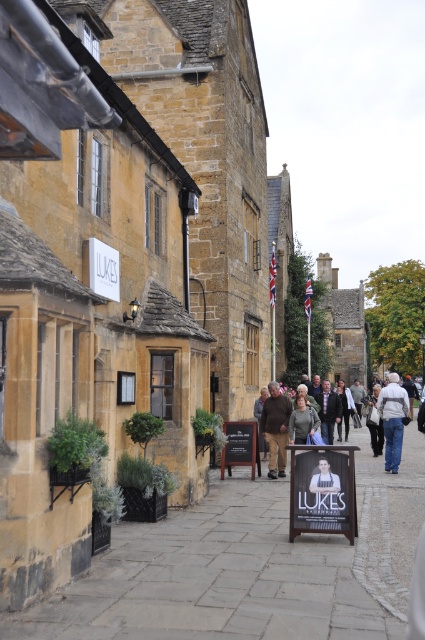
Question: Does brown leather jacket at center appear on the right side of light gray fabric jacket at center?

Choices:
 (A) no
 (B) yes

Answer: (A)

Question: Which point is farther to the camera?

Choices:
 (A) paved stone at center
 (B) light gray fabric jacket at center

Answer: (B)

Question: Does brown leather jacket at center have a smaller size compared to light gray fabric jacket at center?

Choices:
 (A) yes
 (B) no

Answer: (A)

Question: Estimate the real-world distances between objects in this image. Which object is farther from the light gray fabric jacket at center?

Choices:
 (A) brown leather jacket at center
 (B) green fabric jacket at center
 (C) dark gray sweater at center

Answer: (B)

Question: Which point appears closest to the camera in this image?

Choices:
 (A) (368, 448)
 (B) (164, 557)

Answer: (B)

Question: Can you confirm if paved stone at center is positioned to the left of green fabric jacket at center?

Choices:
 (A) yes
 (B) no

Answer: (A)